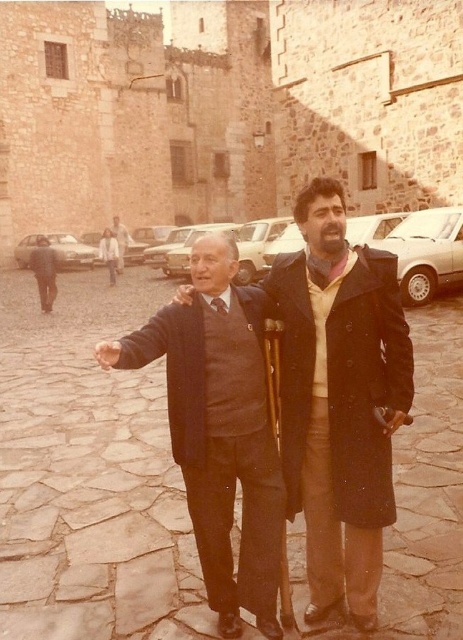
Based on the scene description, where is the dark brown leather coat at center located in the image? Please provide the coordinates.

The dark brown leather coat at center is located at coordinates point (339,397).

You are a delivery driver who needs to park your truck in this town square. Your truck is 2 meters wide. You see the white glossy sedan at center and the matte silver sedan at left. Can you park your truck between them without moving any cars?

The white glossy sedan at center has a lesser width compared to matte silver sedan at left. Since the white glossy sedan at center is narrower than the matte silver sedan at left, the space between them may be insufficient for a 2 meter wide truck. You should check the exact distance between them before deciding.